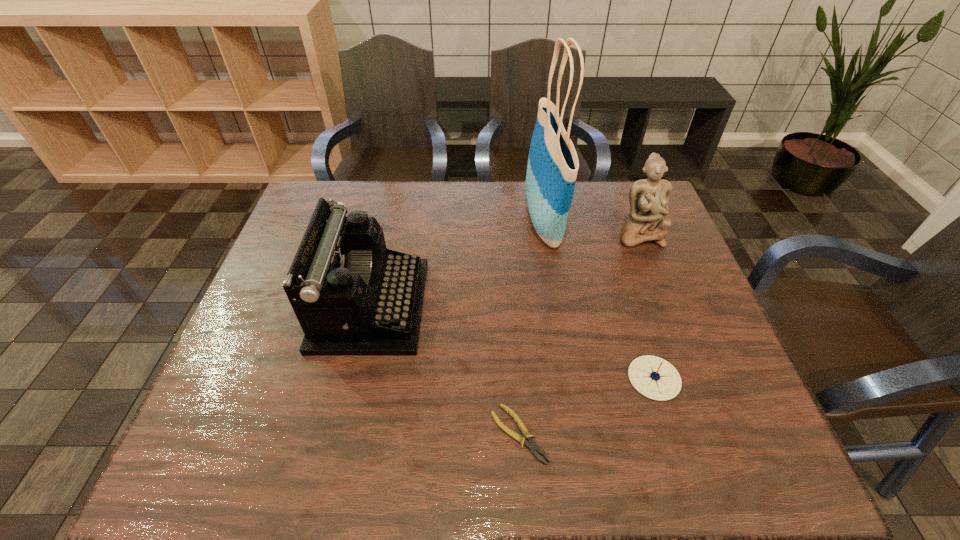
Where is `vacant space at the far edge of the desktop`? vacant space at the far edge of the desktop is located at coordinates (430, 201).

The height and width of the screenshot is (540, 960). In the image, there is a desktop. What are the coordinates of `vacant space at the near edge` in the screenshot? It's located at (430, 474).

In the image, there is a desktop. Where is `free space at the left edge`? free space at the left edge is located at coordinates (296, 244).

The height and width of the screenshot is (540, 960). I want to click on blank space at the right edge, so click(x=656, y=246).

Find the location of a particular element. The height and width of the screenshot is (540, 960). vacant space at the far left corner of the desktop is located at coordinates (305, 202).

Image resolution: width=960 pixels, height=540 pixels. Find the location of `unoccupied area between the figurine and the typewriter`. unoccupied area between the figurine and the typewriter is located at coordinates (505, 270).

Locate an element on the screen. The width and height of the screenshot is (960, 540). vacant area that lies between the pliers and the third object from right to left is located at coordinates (531, 328).

Locate an element on the screen. vacant space that's between the tallest object and the second shortest object is located at coordinates (599, 300).

I want to click on vacant area between the shortest object and the figurine, so click(579, 334).

Where is `vacant space that's between the leftmost object and the figurine`? This screenshot has height=540, width=960. vacant space that's between the leftmost object and the figurine is located at coordinates (505, 270).